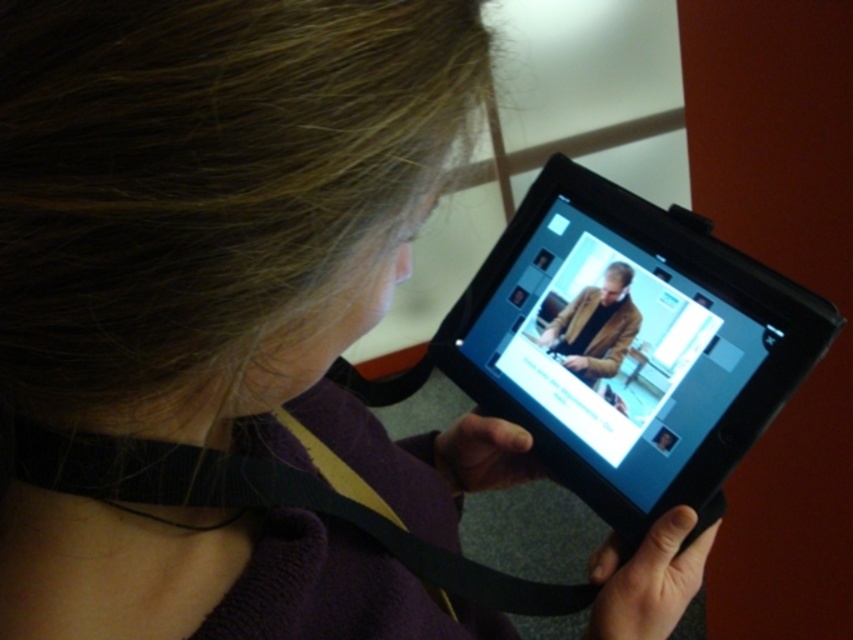
Does black plastic tablet at center have a lesser height compared to brown leather jacket at center?

In fact, black plastic tablet at center may be taller than brown leather jacket at center.

Which of these two, black plastic tablet at center or brown leather jacket at center, stands taller?

black plastic tablet at center

Is point (659, 248) positioned behind point (598, 337)?

No, it is not.

Find the location of a particular element. This screenshot has height=640, width=853. black plastic tablet at center is located at coordinates (630, 344).